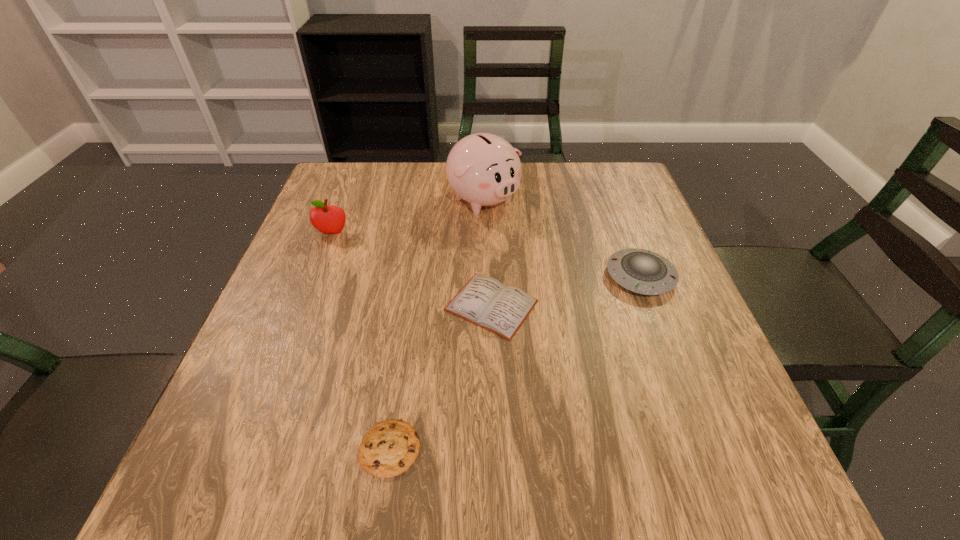
This screenshot has height=540, width=960. In the image, there is a desktop. Find the location of `vacant space at the left edge`. vacant space at the left edge is located at coordinates (322, 355).

This screenshot has height=540, width=960. In the image, there is a desktop. In order to click on blank space at the right edge in this screenshot , I will do `click(686, 444)`.

Locate an element on the screen. The image size is (960, 540). free region at the far left corner is located at coordinates (352, 166).

This screenshot has width=960, height=540. What are the coordinates of `blank area at the far right corner` in the screenshot? It's located at (610, 205).

In the image, there is a desktop. Where is `free space at the near right corner`? Image resolution: width=960 pixels, height=540 pixels. free space at the near right corner is located at coordinates (690, 484).

The image size is (960, 540). Identify the location of vacant space that's between the diary and the second object from left to right. (441, 377).

Where is `free space that is in between the third tallest object and the second object from left to right`? free space that is in between the third tallest object and the second object from left to right is located at coordinates (516, 362).

Find the location of a particular element. free space between the diary and the second object from left to right is located at coordinates pyautogui.click(x=441, y=377).

This screenshot has height=540, width=960. What are the coordinates of `vacant space in between the nearest object and the saucer` in the screenshot? It's located at (516, 362).

I want to click on vacant point located between the piggy bank and the leftmost object, so click(x=408, y=217).